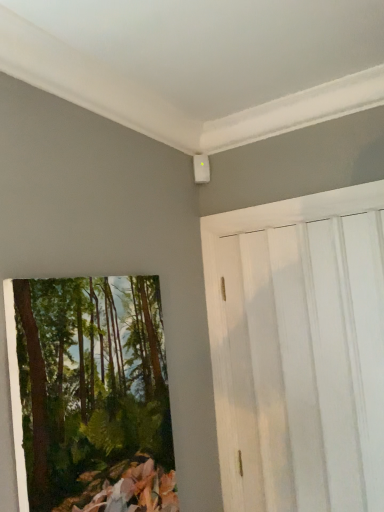
Question: Considering the positions of white wood barn door at upper right and green textured painting at left in the image, is white wood barn door at upper right bigger or smaller than green textured painting at left?

Choices:
 (A) big
 (B) small

Answer: (A)

Question: Looking at their shapes, would you say white wood barn door at upper right is wider or thinner than green textured painting at left?

Choices:
 (A) thin
 (B) wide

Answer: (A)

Question: Is white wood barn door at upper right situated inside green textured painting at left or outside?

Choices:
 (A) outside
 (B) inside

Answer: (A)

Question: Would you say green textured painting at left is inside or outside white wood barn door at upper right?

Choices:
 (A) outside
 (B) inside

Answer: (A)

Question: From a real-world perspective, relative to white wood barn door at upper right, is green textured painting at left vertically above or below?

Choices:
 (A) above
 (B) below

Answer: (B)

Question: From the image's perspective, is green textured painting at left positioned above or below white wood barn door at upper right?

Choices:
 (A) above
 (B) below

Answer: (B)

Question: In terms of width, does green textured painting at left look wider or thinner when compared to white wood barn door at upper right?

Choices:
 (A) wide
 (B) thin

Answer: (A)